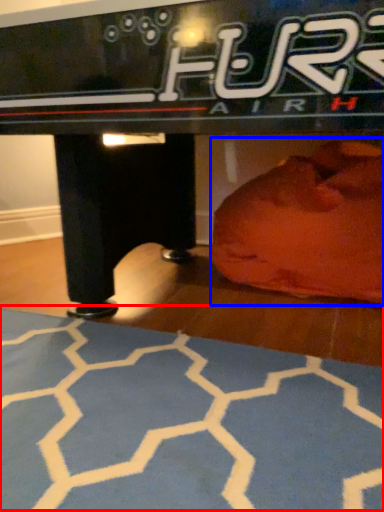
Question: Which object appears closest to the camera in this image, yoga mat (highlighted by a red box) or bean bag chair (highlighted by a blue box)?

Choices:
 (A) yoga mat
 (B) bean bag chair

Answer: (A)